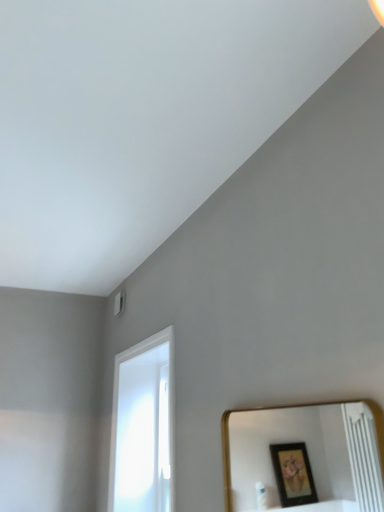
The width and height of the screenshot is (384, 512). What do you see at coordinates (143, 426) in the screenshot?
I see `white glossy door at lower left` at bounding box center [143, 426].

In order to face white glossy door at lower left, should I rotate leftwards or rightwards?

A 6.961 degree turn to the left will do.

Where is `white glossy door at lower left`? white glossy door at lower left is located at coordinates pyautogui.click(x=143, y=426).

This screenshot has height=512, width=384. Identify the location of gold-framed mirror at lower right. (305, 457).

This screenshot has width=384, height=512. What do you see at coordinates (305, 457) in the screenshot?
I see `gold-framed mirror at lower right` at bounding box center [305, 457].

In order to face gold-framed mirror at lower right, should I rotate leftwards or rightwards?

You should rotate right by 13.231 degrees.

Where is `white glossy door at lower left`? The image size is (384, 512). white glossy door at lower left is located at coordinates (143, 426).

Considering the relative positions of gold-framed mirror at lower right and white glossy door at lower left in the image provided, is gold-framed mirror at lower right to the left or to the right of white glossy door at lower left?

Based on their positions, gold-framed mirror at lower right is located to the right of white glossy door at lower left.

Is gold-framed mirror at lower right closer to the viewer compared to white glossy door at lower left?

Yes, it is in front of white glossy door at lower left.

Is point (371, 474) farther from camera compared to point (118, 490)?

Yes.

From the image's perspective, is gold-framed mirror at lower right under white glossy door at lower left?

Actually, gold-framed mirror at lower right appears above white glossy door at lower left in the image.

From a real-world perspective, is gold-framed mirror at lower right over white glossy door at lower left?

No.

Which object is wider, gold-framed mirror at lower right or white glossy door at lower left?

Wider between the two is white glossy door at lower left.

Between gold-framed mirror at lower right and white glossy door at lower left, which one has less height?

Standing shorter between the two is gold-framed mirror at lower right.

In terms of size, does gold-framed mirror at lower right appear bigger or smaller than white glossy door at lower left?

Clearly, gold-framed mirror at lower right is smaller in size than white glossy door at lower left.

Would you say gold-framed mirror at lower right contains white glossy door at lower left?

No, gold-framed mirror at lower right does not contain white glossy door at lower left.

Are gold-framed mirror at lower right and white glossy door at lower left located far from each other?

Yes, gold-framed mirror at lower right and white glossy door at lower left are located far from each other.

Is gold-framed mirror at lower right aimed at white glossy door at lower left?

No, gold-framed mirror at lower right is not facing towards white glossy door at lower left.

The width and height of the screenshot is (384, 512). I want to click on mirror on the right side of white glossy door at lower left, so click(x=305, y=457).

Considering the positions of objects white glossy door at lower left and gold-framed mirror at lower right in the image provided, who is more to the left, white glossy door at lower left or gold-framed mirror at lower right?

From the viewer's perspective, white glossy door at lower left appears more on the left side.

Does white glossy door at lower left come behind gold-framed mirror at lower right?

Yes, it is.

Which point is more distant from viewer, [159,464] or [337,440]?

The point [337,440] is behind.

From the image's perspective, which is below, white glossy door at lower left or gold-framed mirror at lower right?

white glossy door at lower left, from the image's perspective.

From a real-world perspective, which object rests below the other?

In real-world perspective, gold-framed mirror at lower right is lower.

Can you confirm if white glossy door at lower left is wider than gold-framed mirror at lower right?

Correct, the width of white glossy door at lower left exceeds that of gold-framed mirror at lower right.

Can you confirm if white glossy door at lower left is shorter than gold-framed mirror at lower right?

No, white glossy door at lower left is not shorter than gold-framed mirror at lower right.

Between white glossy door at lower left and gold-framed mirror at lower right, which one has smaller size?

With smaller size is gold-framed mirror at lower right.

Is white glossy door at lower left not inside gold-framed mirror at lower right?

white glossy door at lower left is positioned outside gold-framed mirror at lower right.

Would you consider white glossy door at lower left to be distant from gold-framed mirror at lower right?

Indeed, white glossy door at lower left is not near gold-framed mirror at lower right.

Is white glossy door at lower left turned away from gold-framed mirror at lower right?

white glossy door at lower left does not have its back to gold-framed mirror at lower right.

How many degrees apart are the facing directions of white glossy door at lower left and gold-framed mirror at lower right?

There is a 0.0958-degree angle between the facing directions of white glossy door at lower left and gold-framed mirror at lower right.

The image size is (384, 512). I want to click on mirror above the white glossy door at lower left (from the image's perspective), so [x=305, y=457].

You are a GUI agent. You are given a task and a screenshot of the screen. Output one action in this format:
    pyautogui.click(x=<x>, y=<y>)
    Task: Click on the mirror that appears on the right of white glossy door at lower left
    
    Given the screenshot: What is the action you would take?
    pyautogui.click(x=305, y=457)

This screenshot has height=512, width=384. I want to click on window lying behind the gold-framed mirror at lower right, so click(x=143, y=426).